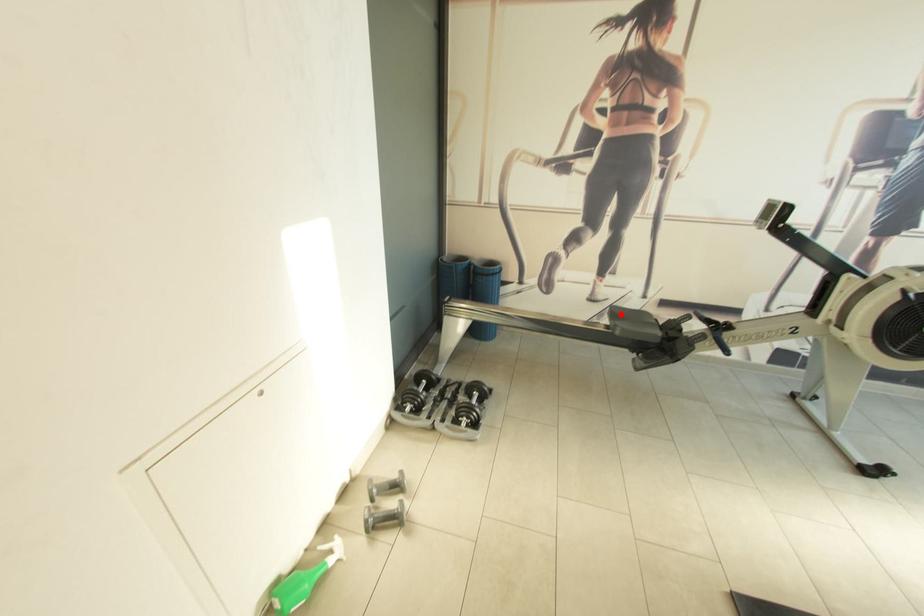
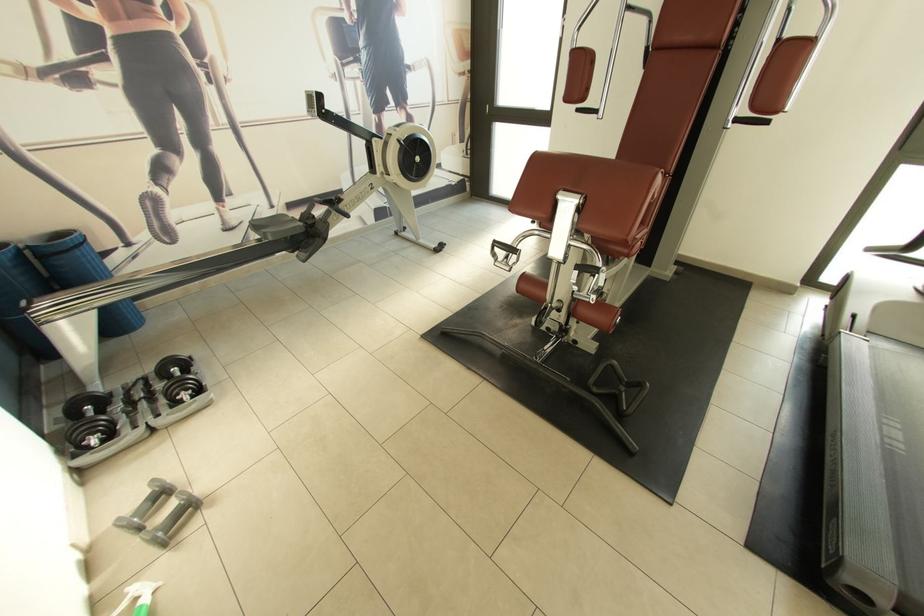
Question: I am providing you with two images of the same scene from different viewpoints. Given a red point in image1, look at the same physical point in image2. Is it:

Choices:
 (A) Closer to the viewpoint
 (B) Farther from the viewpoint

Answer: (B)